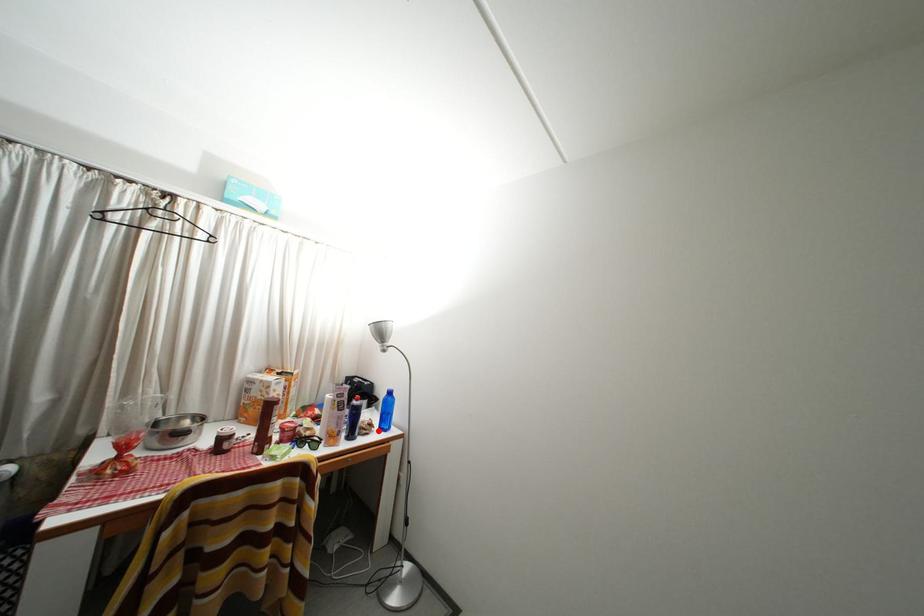
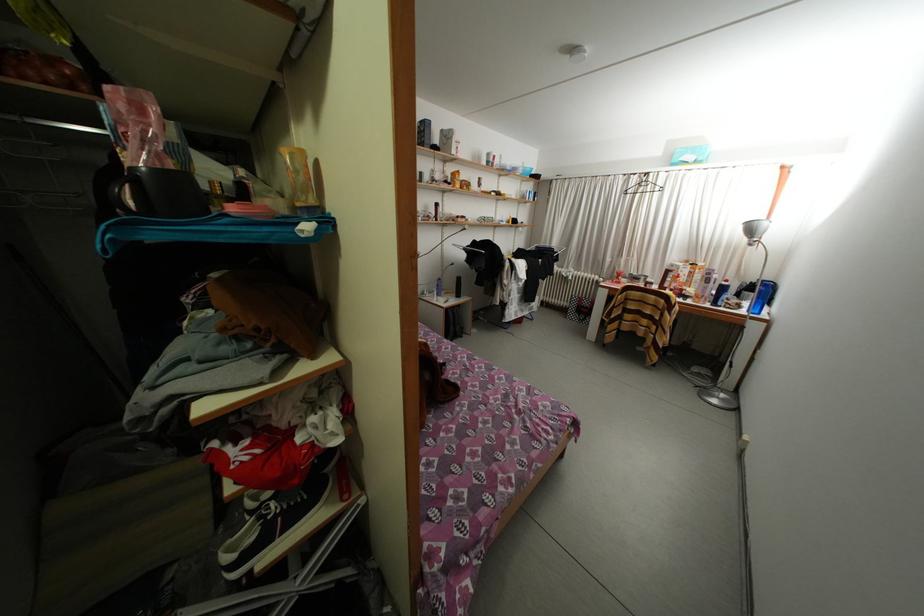
Question: I am providing you with two images of the same scene from different viewpoints. Image1 has a red point marked. In image2, the corresponding 3D location appears at what relative position? Reply with the corresponding letter.

Choices:
 (A) Closer
 (B) Farther

Answer: (A)